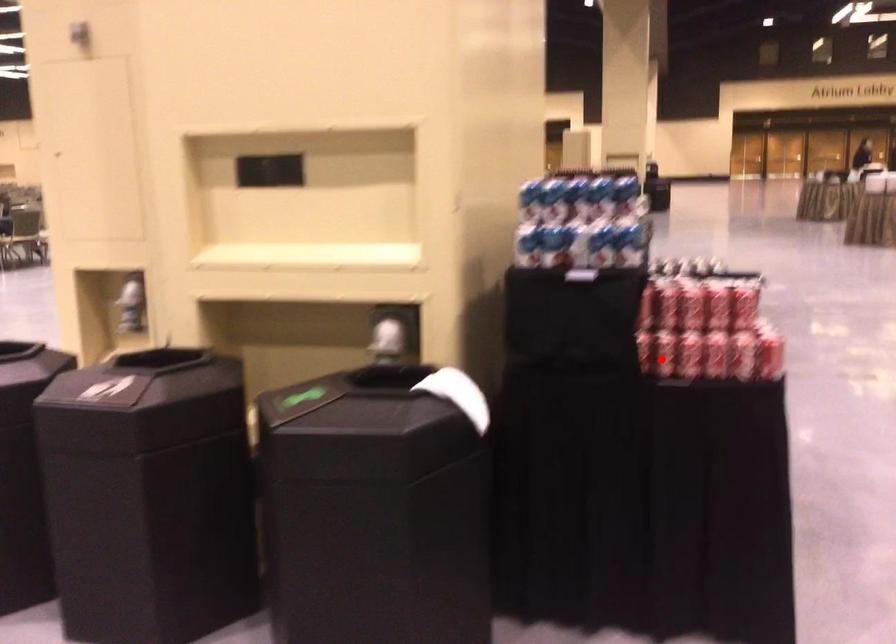
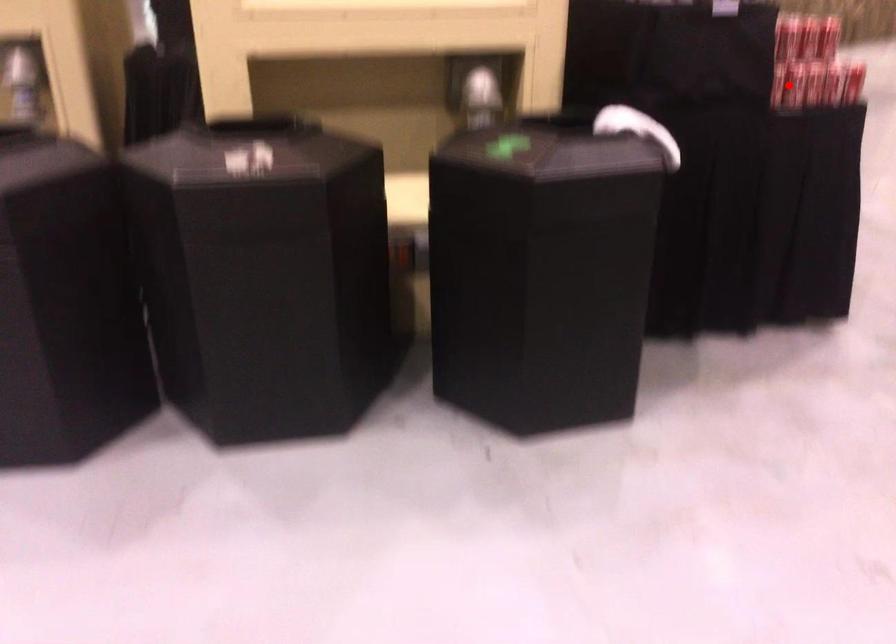
I am providing you with two images of the same scene from different viewpoints. A red point is marked on the first image and another point is marked on the second image. Do the highlighted points in image1 and image2 indicate the same real-world spot?

Yes